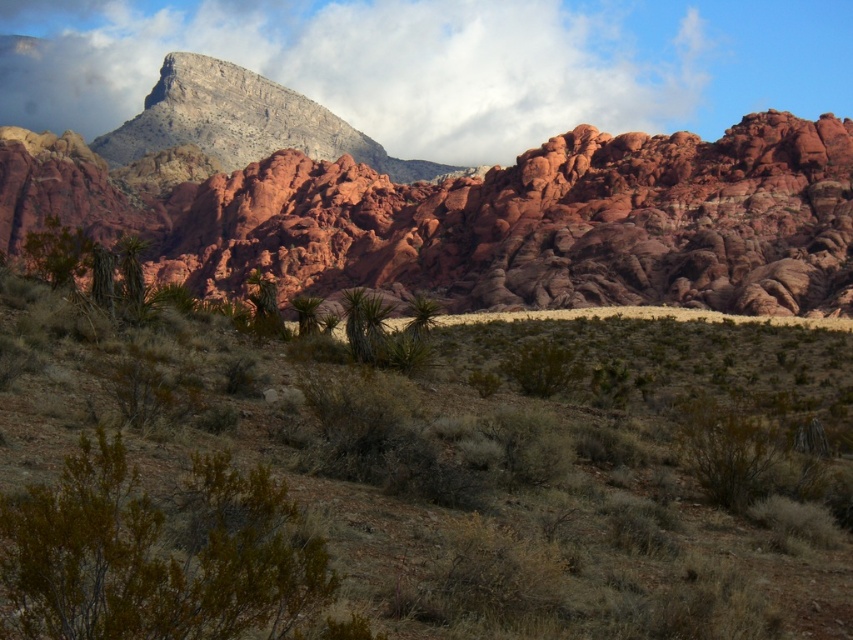
You are navigating a desert and need to determine the position of the cloudy sky relative to your current location. According to the image, where is the cloudy sky at upper center in terms of direction and elevation?

The cloudy sky at upper center is located at point coordinates approximately 0.105 on the horizontal axis and 0.427 on the vertical axis. This places it slightly to the left of the center horizontally and about halfway up vertically from the bottom of the image.

You are standing in the desert landscape shown in the image. You see a brown shrubbery at center. Is the point at coordinate (403, 490) located on the brown shrubbery at center?

Yes, the point at coordinate (403, 490) is located on the brown shrubbery at center.